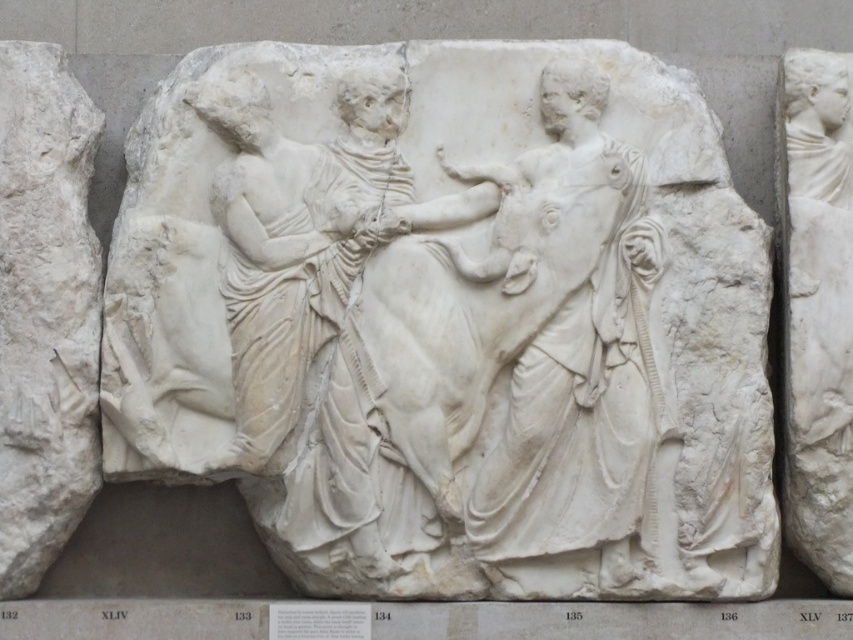
In the scene shown: You are an art conservator examining a classical marble sculpture. You notice two elements, the white marble relief at center and the white marble statue at right. Which one is located to the left of the other?

The white marble relief at center is positioned on the left side of the white marble statue at right.

You are an art conservator examining the classical marble relief sculpture. You need to determine which object takes up more area in the relief. Based on the scene, which one is larger between the white marble figure at center and the white marble statue at right?

The white marble statue at right is larger because it occupies more space than the white marble figure at center.